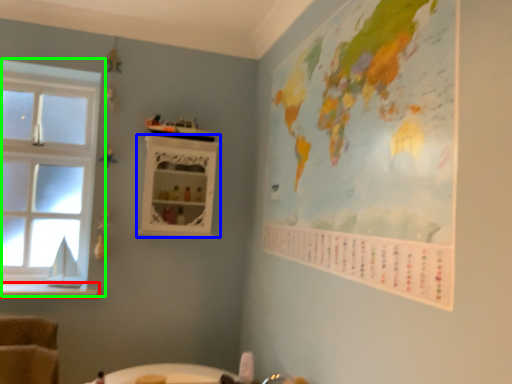
Question: Which object is the farthest from window sill (highlighted by a red box)? Choose among these: shelf (highlighted by a blue box) or window (highlighted by a green box).

Choices:
 (A) shelf
 (B) window

Answer: (A)